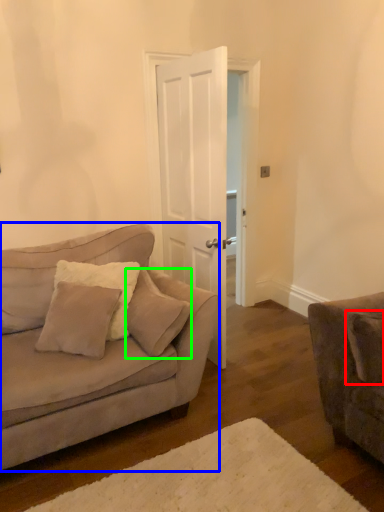
Question: Which object is the closest to the pillow (highlighted by a red box)? Choose among these: studio couch (highlighted by a blue box) or pillow (highlighted by a green box).

Choices:
 (A) studio couch
 (B) pillow

Answer: (B)